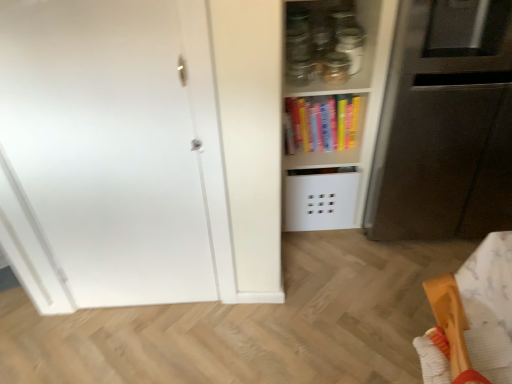
Where is `transparent glass jar at upper center`? The width and height of the screenshot is (512, 384). transparent glass jar at upper center is located at coordinates (336, 68).

Describe the element at coordinates (472, 319) in the screenshot. I see `wooden spatula at lower right` at that location.

Identify the location of transparent glass jar at upper center. This screenshot has height=384, width=512. (336, 68).

Which object is closer to the camera taking this photo, matt black microwave at right or transparent glass jar at upper center?

matt black microwave at right is more forward.

Is matt black microwave at right to the left or to the right of transparent glass jar at upper center in the image?

matt black microwave at right is to the right of transparent glass jar at upper center.

Who is taller, matt black microwave at right or transparent glass jar at upper center?

Standing taller between the two is matt black microwave at right.

Find the location of `appliance on the right of the hardcover books at center`. appliance on the right of the hardcover books at center is located at coordinates (445, 125).

Is matt black microwave at right not close to hardcover books at center?

No, matt black microwave at right is not far from hardcover books at center.

Is matt black microwave at right spatially inside hardcover books at center, or outside of it?

matt black microwave at right cannot be found inside hardcover books at center.

From a real-world perspective, is matt black microwave at right over hardcover books at center?

Correct, in the physical world, matt black microwave at right is higher than hardcover books at center.

Is the surface of white matte door at left in direct contact with hardcover books at center?

No, white matte door at left is not touching hardcover books at center.

Is white matte door at left to the left of hardcover books at center from the viewer's perspective?

Correct, you'll find white matte door at left to the left of hardcover books at center.

Is white matte door at left turned away from hardcover books at center?

white matte door at left is not turned away from hardcover books at center.

Between wooden spatula at lower right and hardcover books at center, which one has more height?

hardcover books at center is taller.

What's the angular difference between wooden spatula at lower right and hardcover books at center's facing directions?

90 degrees separate the facing orientations of wooden spatula at lower right and hardcover books at center.

From the image's perspective, between wooden spatula at lower right and hardcover books at center, who is located below?

wooden spatula at lower right is shown below in the image.

Is wooden spatula at lower right outside of hardcover books at center?

wooden spatula at lower right lies outside hardcover books at center's area.

Is white matte door at left facing towards wooden spatula at lower right?

No, white matte door at left is not turned towards wooden spatula at lower right.

Is white matte door at left positioned in front of wooden spatula at lower right?

No.

Do you think white matte door at left is within wooden spatula at lower right, or outside of it?

white matte door at left is located beyond the bounds of wooden spatula at lower right.

In the scene shown: Considering the sizes of white matte door at left and wooden spatula at lower right in the image, is white matte door at left taller or shorter than wooden spatula at lower right?

Considering their sizes, white matte door at left has more height than wooden spatula at lower right.

Who is taller, wooden spatula at lower right or matt black microwave at right?

Standing taller between the two is matt black microwave at right.

From a real-world perspective, is wooden spatula at lower right physically located above or below matt black microwave at right?

wooden spatula at lower right is situated higher than matt black microwave at right in the real world.

Between wooden spatula at lower right and matt black microwave at right, which one appears on the right side from the viewer's perspective?

Positioned to the right is matt black microwave at right.

Does wooden spatula at lower right lie behind matt black microwave at right?

No, wooden spatula at lower right is in front of matt black microwave at right.

Considering the sizes of objects white matte door at left and matt black microwave at right in the image provided, who is shorter, white matte door at left or matt black microwave at right?

matt black microwave at right is shorter.

Is white matte door at left far away from matt black microwave at right?

No, white matte door at left is not far from matt black microwave at right.

From a real-world perspective, is white matte door at left positioned over matt black microwave at right based on gravity?

Indeed, from a real-world perspective, white matte door at left stands above matt black microwave at right.

From the image's perspective, which one is positioned higher, white matte door at left or matt black microwave at right?

matt black microwave at right appears higher in the image.

Image resolution: width=512 pixels, height=384 pixels. In order to click on glass jar on the left of matt black microwave at right in this screenshot , I will do `click(336, 68)`.

At what (x,y) coordinates should I click in order to perform the action: click on appliance located in front of the hardcover books at center. Please return your answer as a coordinate pair (x, y). The image size is (512, 384). Looking at the image, I should click on (445, 125).

Based on their spatial positions, is white matte door at left or wooden spatula at lower right closer to hardcover books at center?

white matte door at left is positioned closer to the anchor hardcover books at center.

Estimate the real-world distances between objects in this image. Which object is closer to transparent glass jar at upper center, white matte door at left or wooden spatula at lower right?

The object closer to transparent glass jar at upper center is white matte door at left.

Looking at this image, based on their spatial positions, is white matte door at left or wooden spatula at lower right closer to matt black microwave at right?

wooden spatula at lower right is positioned closer to the anchor matt black microwave at right.

From the image, which object appears to be farther from white matte door at left, transparent glass jar at upper center or matt black microwave at right?

Among the two, matt black microwave at right is located further to white matte door at left.

When comparing their distances from wooden spatula at lower right, does white matte door at left or transparent glass jar at upper center seem further?

transparent glass jar at upper center is positioned further to the anchor wooden spatula at lower right.

Considering their positions, is transparent glass jar at upper center positioned closer to white matte door at left than hardcover books at center?

Among the two, hardcover books at center is located nearer to white matte door at left.

When comparing their distances from transparent glass jar at upper center, does hardcover books at center or wooden spatula at lower right seem closer?

hardcover books at center lies closer to transparent glass jar at upper center than the other object.

Estimate the real-world distances between objects in this image. Which object is closer to wooden spatula at lower right, hardcover books at center or matt black microwave at right?

Among the two, matt black microwave at right is located nearer to wooden spatula at lower right.

Locate an element on the screen. This screenshot has height=384, width=512. book between white matte door at left and matt black microwave at right is located at coordinates (323, 123).

This screenshot has width=512, height=384. What are the coordinates of `appliance between wooden spatula at lower right and hardcover books at center in the front-back direction` in the screenshot? It's located at (445, 125).

Where is `glass jar between white matte door at left and wooden spatula at lower right`? Image resolution: width=512 pixels, height=384 pixels. glass jar between white matte door at left and wooden spatula at lower right is located at coordinates (336, 68).

Locate an element on the screen. This screenshot has width=512, height=384. book situated between white matte door at left and transparent glass jar at upper center from left to right is located at coordinates (323, 123).